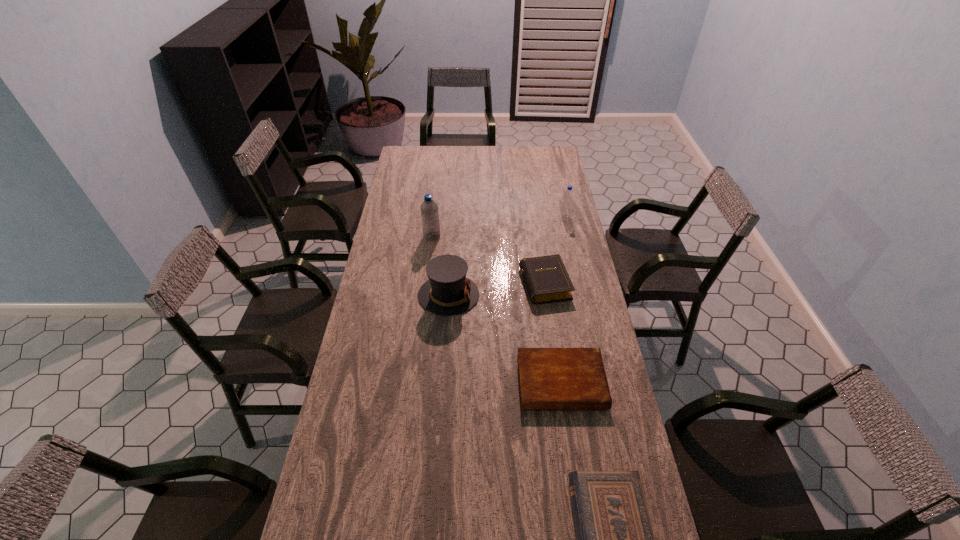
Image resolution: width=960 pixels, height=540 pixels. In order to click on the left water bottle in this screenshot , I will do `click(429, 209)`.

Identify the location of the nearer water bottle. The image size is (960, 540). (429, 209).

Locate an element on the screen. the right water bottle is located at coordinates (568, 195).

The width and height of the screenshot is (960, 540). What are the coordinates of `the farther water bottle` in the screenshot? It's located at (568, 195).

At what (x,y) coordinates should I click in order to perform the action: click on dress hat. Please return your answer as a coordinate pair (x, y). The width and height of the screenshot is (960, 540). Looking at the image, I should click on (447, 292).

The image size is (960, 540). I want to click on the farthest Bible, so click(x=546, y=278).

This screenshot has width=960, height=540. I want to click on the fifth farthest object, so click(x=549, y=378).

The width and height of the screenshot is (960, 540). I want to click on free location located 0.220m on the back of the taller water bottle, so click(x=436, y=203).

Locate an element on the screen. This screenshot has height=540, width=960. free spot located 0.060m on the front of the shorter water bottle is located at coordinates 567,227.

At what (x,y) coordinates should I click in order to perform the action: click on blank space located 0.130m with goggles on the front of the dress hat. Please return your answer as a coordinate pair (x, y). Image resolution: width=960 pixels, height=540 pixels. Looking at the image, I should click on (513, 295).